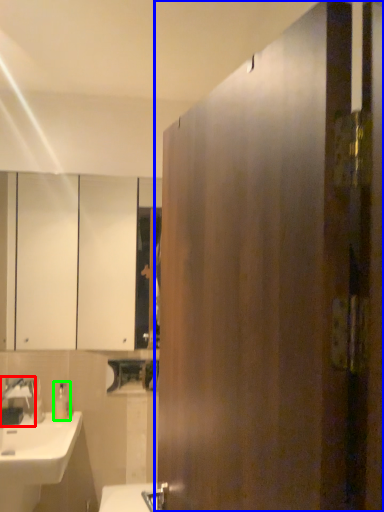
Question: Based on their relative distances, which object is farther from tap (highlighted by a red box)? Choose from door (highlighted by a blue box) and soap dispenser (highlighted by a green box).

Choices:
 (A) door
 (B) soap dispenser

Answer: (A)